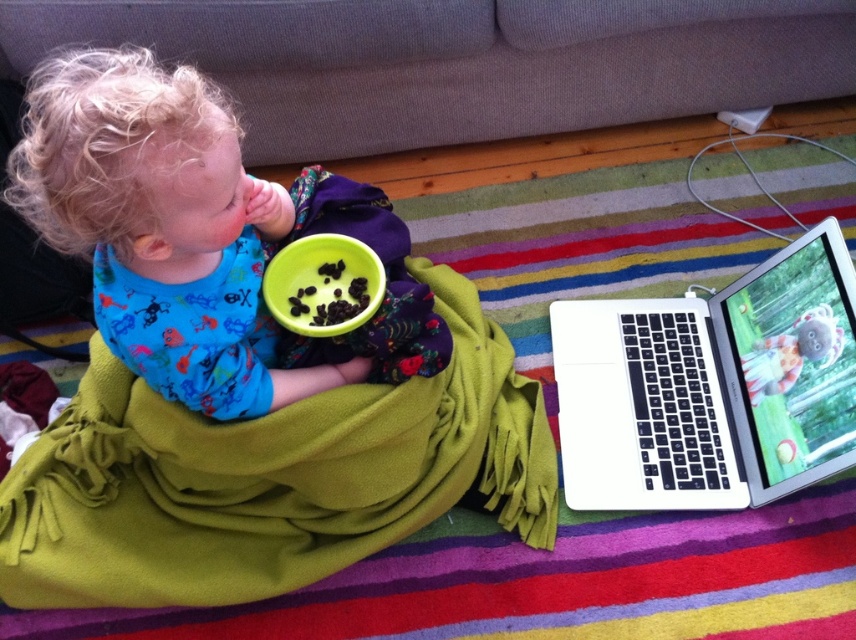
Question: Which of the following is the closest to the observer?

Choices:
 (A) silver metallic laptop at lower right
 (B) green fleece blanket at center
 (C) soft plush toy at center
 (D) blue cotton shirt at center

Answer: (D)

Question: Which point is closer to the camera?

Choices:
 (A) (207, 474)
 (B) (765, 387)
 (C) (265, 54)

Answer: (A)

Question: Is gray fabric couch at upper center positioned before blue cotton shirt at center?

Choices:
 (A) no
 (B) yes

Answer: (A)

Question: Is green fleece blanket at center to the right of gray fabric couch at upper center from the viewer's perspective?

Choices:
 (A) yes
 (B) no

Answer: (B)

Question: Which point appears closest to the camera in this image?

Choices:
 (A) (635, 99)
 (B) (119, 280)
 (C) (688, 440)
 (D) (764, 388)

Answer: (B)

Question: Is green fleece blanket at center thinner than silver metallic laptop at lower right?

Choices:
 (A) no
 (B) yes

Answer: (A)